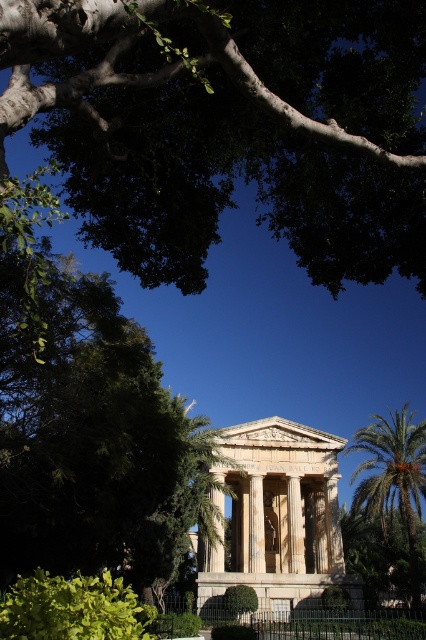
How far apart are green leafy hedge at lower left and green leafy palm at right?

They are 40.25 meters apart.

Can you confirm if green leafy hedge at lower left is thinner than green leafy palm at right?

Incorrect, green leafy hedge at lower left's width is not less than green leafy palm at right's.

Image resolution: width=426 pixels, height=640 pixels. I want to click on green leafy hedge at lower left, so click(72, 609).

Who is positioned more to the right, green leafy hedge at lower left or green leafy bush at center?

From the viewer's perspective, green leafy bush at center appears more on the right side.

Between green leafy hedge at lower left and green leafy bush at center, which one has less height?

Standing shorter between the two is green leafy bush at center.

Does point (60, 636) come in front of point (235, 596)?

Yes, it is in front of point (235, 596).

Locate an element on the screen. green leafy hedge at lower left is located at coordinates (72, 609).

Is green leafy tree at upper center bigger than green leafy hedge at lower left?

Indeed, green leafy tree at upper center has a larger size compared to green leafy hedge at lower left.

Based on the photo, between green leafy tree at upper center and green leafy hedge at lower left, which one is positioned higher?

green leafy tree at upper center is higher up.

At what (x,y) coordinates should I click in order to perform the action: click on green leafy tree at upper center. Please return your answer as a coordinate pair (x, y). Image resolution: width=426 pixels, height=640 pixels. Looking at the image, I should click on (229, 125).